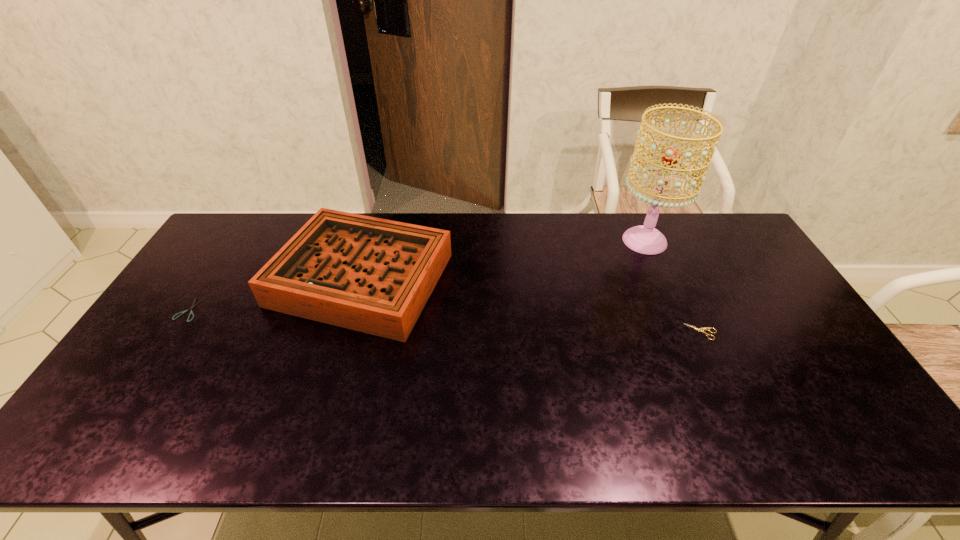
Locate an element on the screen. The image size is (960, 540). free location located 0.180m on the front of the shortest object is located at coordinates (146, 375).

The width and height of the screenshot is (960, 540). I want to click on lampshade located in the far edge section of the desktop, so click(x=646, y=239).

You are a GUI agent. You are given a task and a screenshot of the screen. Output one action in this format:
    pyautogui.click(x=<x>, y=<y>)
    Task: Click on the gameboard present at the far edge
    The width and height of the screenshot is (960, 540).
    Given the screenshot: What is the action you would take?
    pyautogui.click(x=372, y=275)

You are a GUI agent. You are given a task and a screenshot of the screen. Output one action in this format:
    pyautogui.click(x=<x>, y=<y>)
    Task: Click on the object that is at the left edge
    The width and height of the screenshot is (960, 540).
    Given the screenshot: What is the action you would take?
    pyautogui.click(x=191, y=312)

The width and height of the screenshot is (960, 540). In order to click on vacant position at the far edge of the desktop in this screenshot , I will do `click(464, 252)`.

In the image, there is a desktop. At what (x,y) coordinates should I click in order to perform the action: click on vacant region at the near edge. Please return your answer as a coordinate pair (x, y). This screenshot has height=540, width=960. Looking at the image, I should click on (572, 438).

This screenshot has width=960, height=540. What are the coordinates of `free space at the left edge` in the screenshot? It's located at (214, 318).

Locate an element on the screen. The width and height of the screenshot is (960, 540). free space at the near left corner of the desktop is located at coordinates (110, 422).

Identify the location of free space between the nearer shears and the tallest object. The image size is (960, 540). (673, 286).

You are a GUI agent. You are given a task and a screenshot of the screen. Output one action in this format:
    pyautogui.click(x=<x>, y=<y>)
    Task: Click on the free area in between the taller shears and the second object from left to right
    The width and height of the screenshot is (960, 540).
    Given the screenshot: What is the action you would take?
    pyautogui.click(x=532, y=305)